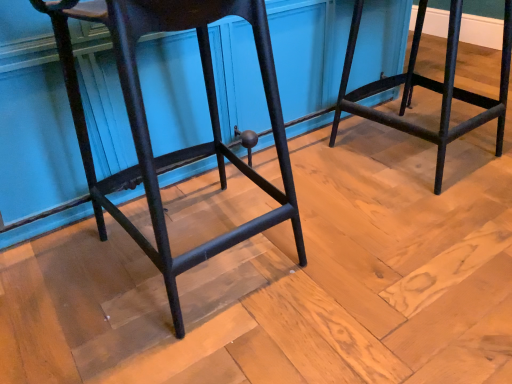
Find the location of a particular element. This screenshot has width=512, height=384. free space in front of matte black stool at center, which is counted as the first furniture, starting from the left is located at coordinates (205, 344).